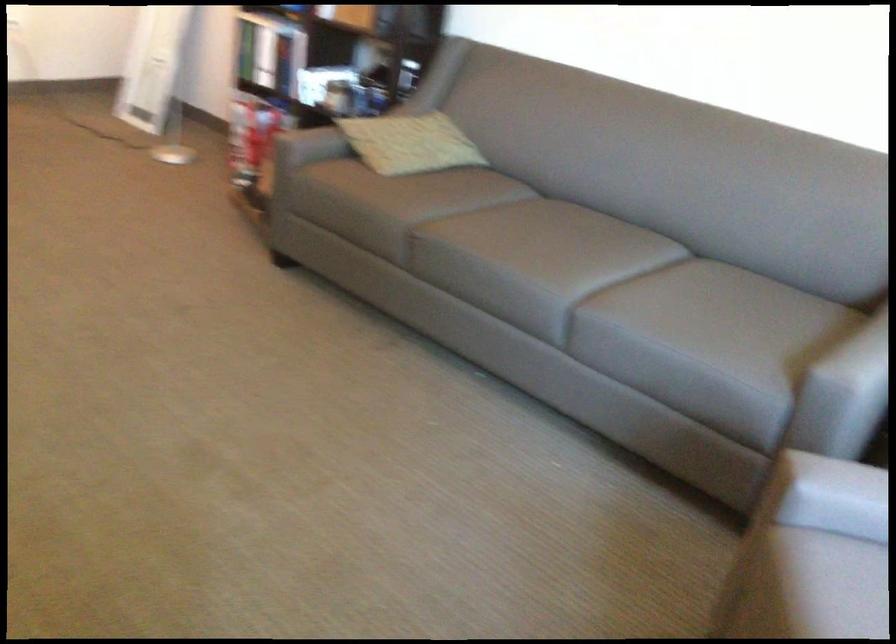
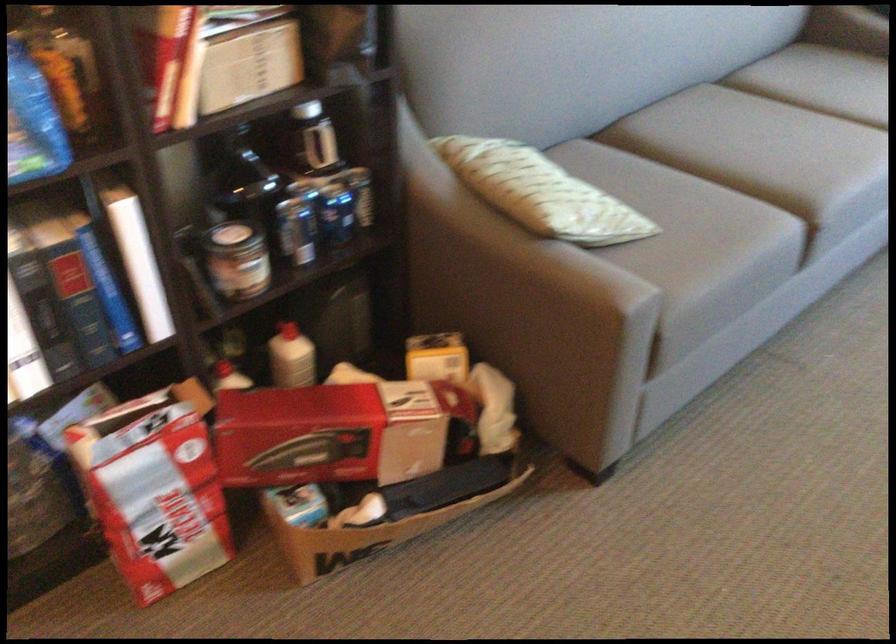
Locate, in the second image, the point that corresponds to point (297, 129) in the first image.

(514, 281)